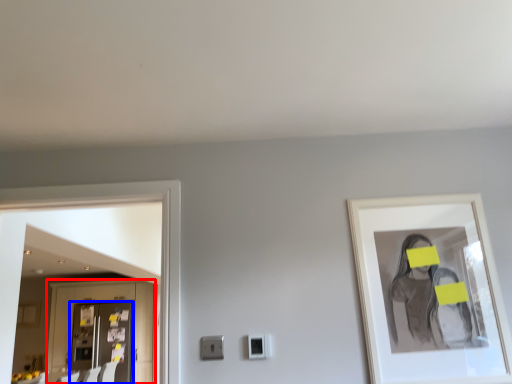
Question: Which of the following is the farthest to the observer, cabinetry (highlighted by a red box) or door (highlighted by a blue box)?

Choices:
 (A) cabinetry
 (B) door

Answer: (A)